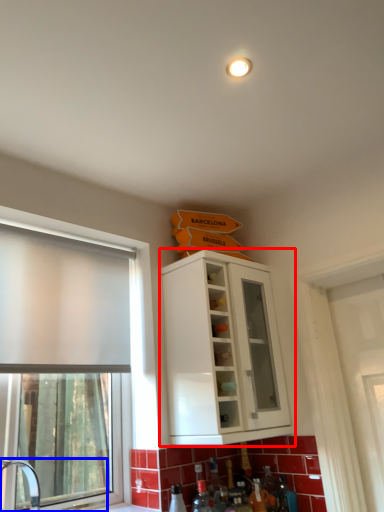
Question: Which object is further to the camera taking this photo, cabinetry (highlighted by a red box) or sink (highlighted by a blue box)?

Choices:
 (A) cabinetry
 (B) sink

Answer: (A)